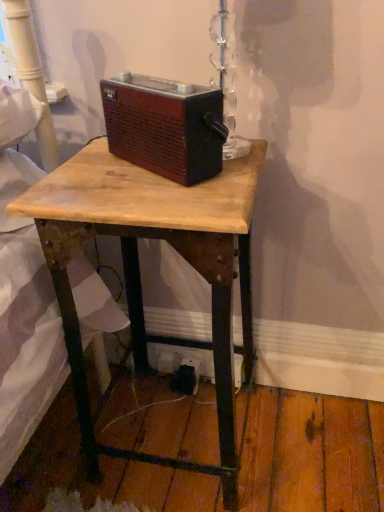
Question: Is wooden desk at center turned away from brown wood radio at center?

Choices:
 (A) no
 (B) yes

Answer: (A)

Question: Considering the relative sizes of wooden desk at center and brown wood radio at center in the image provided, is wooden desk at center smaller than brown wood radio at center?

Choices:
 (A) yes
 (B) no

Answer: (B)

Question: Are wooden desk at center and brown wood radio at center beside each other?

Choices:
 (A) no
 (B) yes

Answer: (A)

Question: Is wooden desk at center taller than brown wood radio at center?

Choices:
 (A) no
 (B) yes

Answer: (B)

Question: Are wooden desk at center and brown wood radio at center located far from each other?

Choices:
 (A) no
 (B) yes

Answer: (A)

Question: From the image's perspective, would you say wooden desk at center is shown under brown wood radio at center?

Choices:
 (A) yes
 (B) no

Answer: (A)

Question: Is wooden desk at center completely or partially inside black plastic outlet at lower center?

Choices:
 (A) yes
 (B) no

Answer: (B)

Question: Considering the relative positions of black plastic outlet at lower center and wooden desk at center in the image provided, is black plastic outlet at lower center to the left of wooden desk at center from the viewer's perspective?

Choices:
 (A) yes
 (B) no

Answer: (B)

Question: Is black plastic outlet at lower center positioned before wooden desk at center?

Choices:
 (A) no
 (B) yes

Answer: (A)

Question: Is black plastic outlet at lower center facing towards wooden desk at center?

Choices:
 (A) yes
 (B) no

Answer: (A)

Question: Is black plastic outlet at lower center positioned far away from wooden desk at center?

Choices:
 (A) yes
 (B) no

Answer: (B)

Question: From the image's perspective, is black plastic outlet at lower center located above wooden desk at center?

Choices:
 (A) yes
 (B) no

Answer: (B)

Question: Is black plastic outlet at lower center turned away from brown wood radio at center?

Choices:
 (A) no
 (B) yes

Answer: (A)